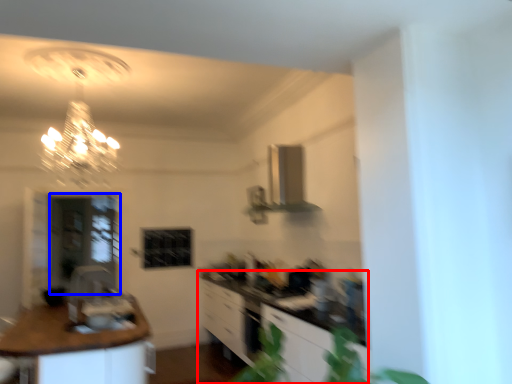
Question: Which point is closer to the camera, cabinetry (highlighted by a red box) or glass door (highlighted by a blue box)?

Choices:
 (A) cabinetry
 (B) glass door

Answer: (A)